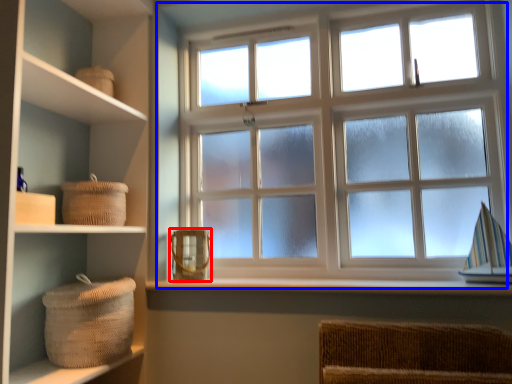
Question: Which point is further to the camera, basket (highlighted by a red box) or window (highlighted by a blue box)?

Choices:
 (A) basket
 (B) window

Answer: (A)